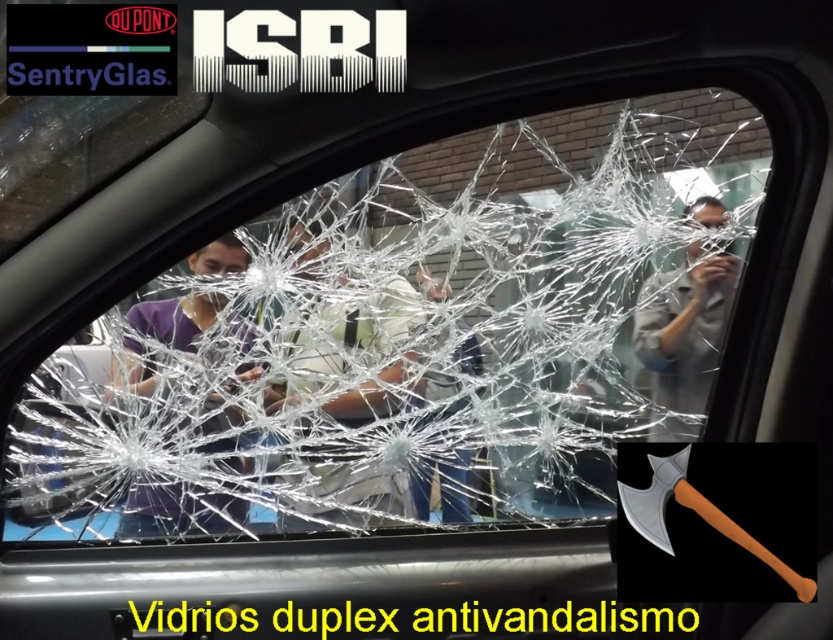
From the picture: Does purple matte shirt at center appear on the right side of blue denim jeans at center?

In fact, purple matte shirt at center is to the left of blue denim jeans at center.

Is purple matte shirt at center positioned in front of blue denim jeans at center?

Yes, purple matte shirt at center is closer to the viewer.

From the picture: Who is more distant from viewer, (140, 349) or (467, 518)?

The point (467, 518) is more distant.

The width and height of the screenshot is (833, 640). What are the coordinates of `purple matte shirt at center` in the screenshot? It's located at (173, 512).

Can you confirm if matte black shirt at center is bigger than matte gray shirt at center?

Yes, matte black shirt at center is bigger than matte gray shirt at center.

Is matte black shirt at center taller than matte gray shirt at center?

Yes.

Is point (317, 371) less distant than point (714, 342)?

No, (317, 371) is further to viewer.

Where is `matte black shirt at center`? This screenshot has width=833, height=640. matte black shirt at center is located at coordinates (348, 355).

Is silver metallic axe at center taller than purple matte shirt at center?

Incorrect, silver metallic axe at center's height is not larger of purple matte shirt at center's.

Can you confirm if silver metallic axe at center is positioned below purple matte shirt at center?

Correct, silver metallic axe at center is located below purple matte shirt at center.

Which is in front, point (737, 586) or point (148, 365)?

Point (737, 586) is more forward.

Locate an element on the screen. This screenshot has width=833, height=640. silver metallic axe at center is located at coordinates (716, 522).